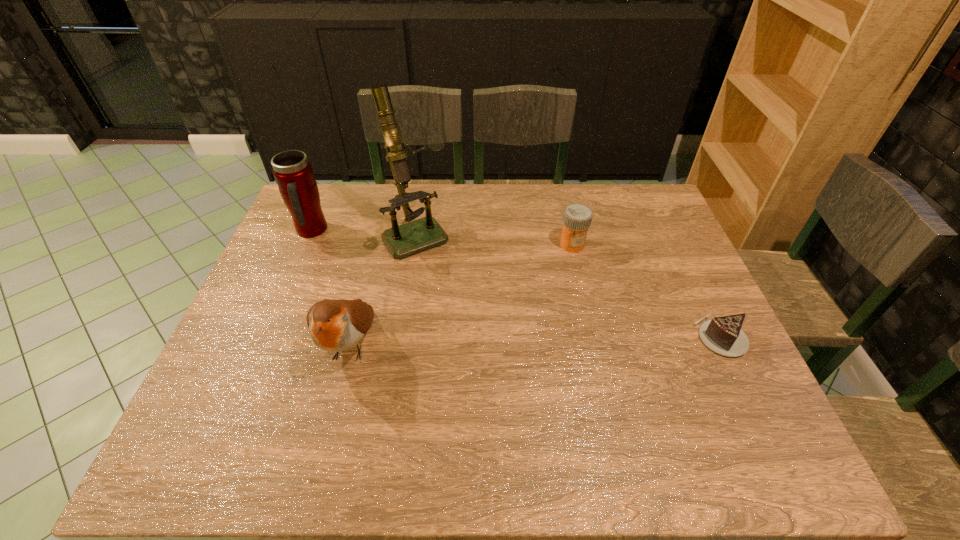
Locate an element on the screen. free space between the tallest object and the bird is located at coordinates (383, 289).

Point out which object is positioned as the nearest to the chocolate cake. Please provide its 2D coordinates. Your answer should be formatted as a tuple, i.e. [(x, y)], where the tuple contains the x and y coordinates of a point satisfying the conditions above.

[(577, 217)]

Find the location of `the second closest object to the second object from right to left`. the second closest object to the second object from right to left is located at coordinates (403, 240).